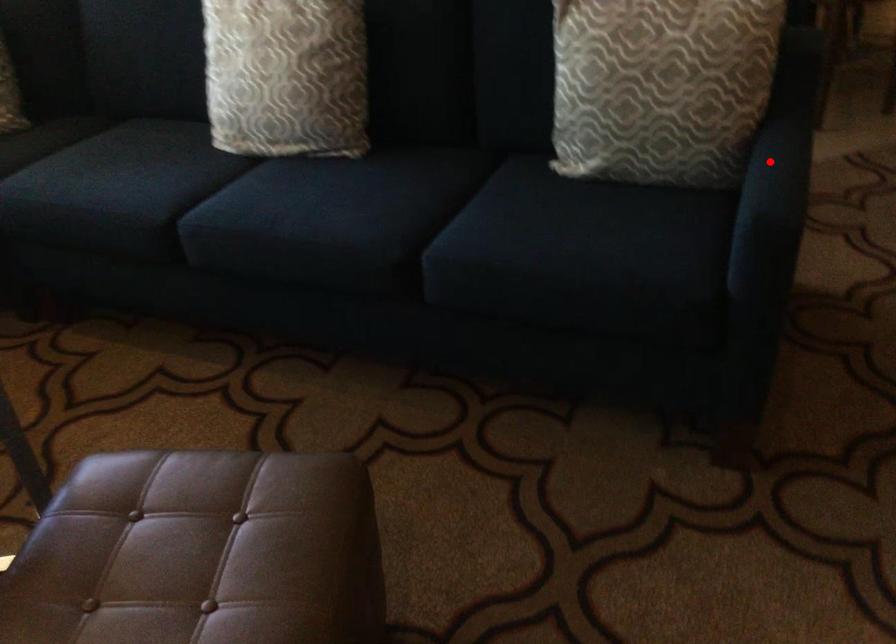
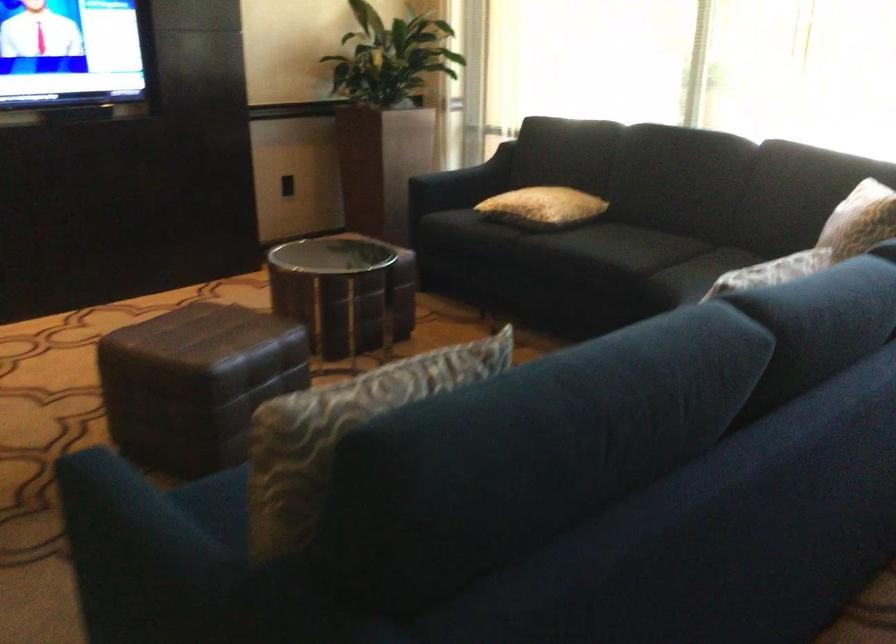
Locate, in the second image, the point that corresponds to the highlighted location in the first image.

(134, 534)